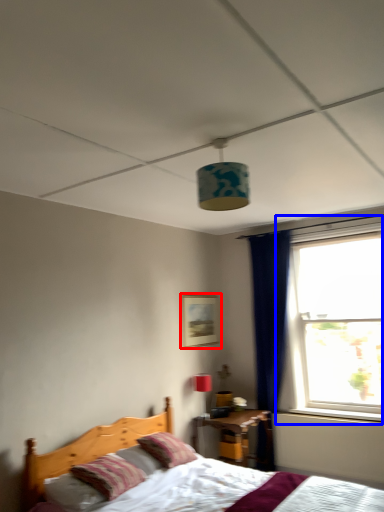
Question: Which object is closer to the camera taking this photo, picture frame (highlighted by a red box) or window (highlighted by a blue box)?

Choices:
 (A) picture frame
 (B) window

Answer: (B)